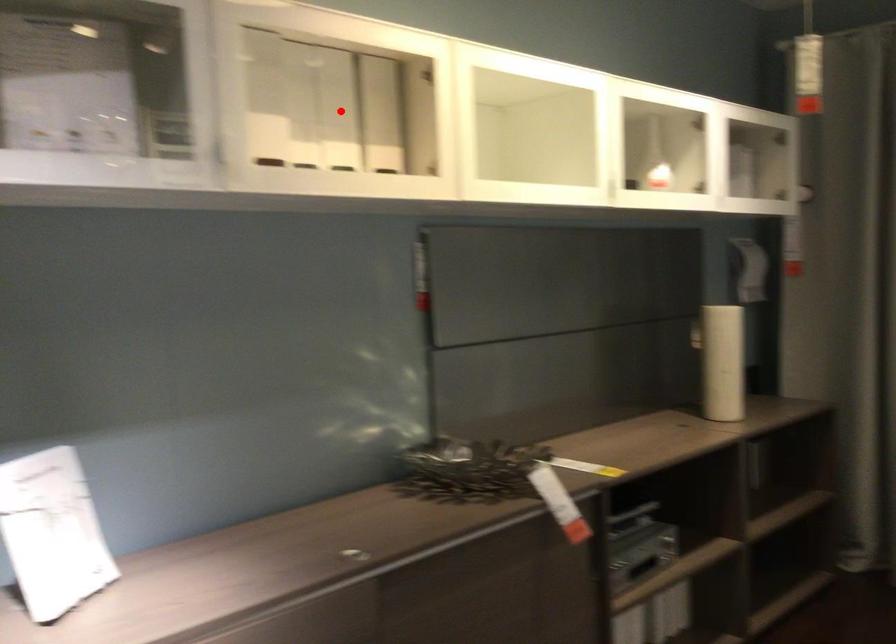
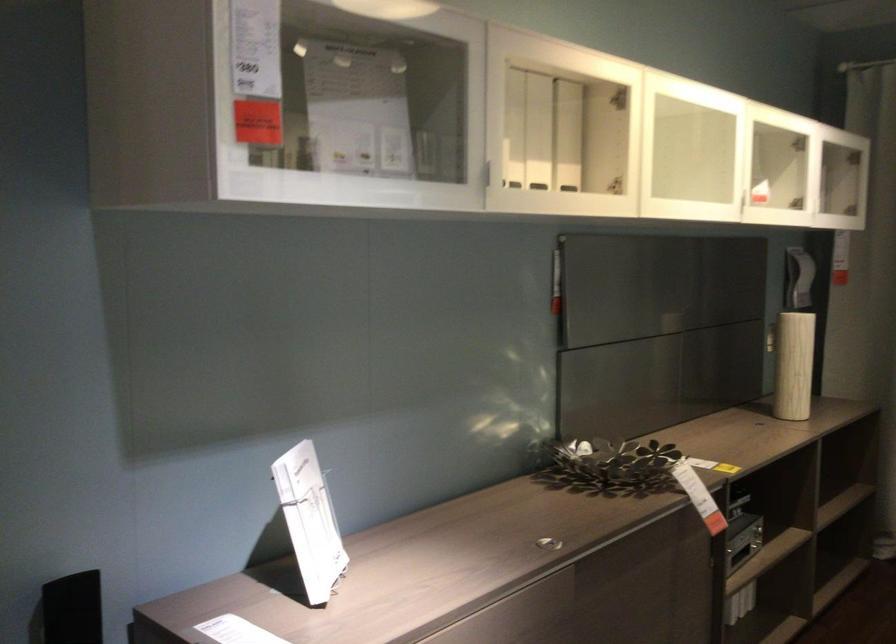
In the second image, find the point that corresponds to the highlighted location in the first image.

(538, 131)